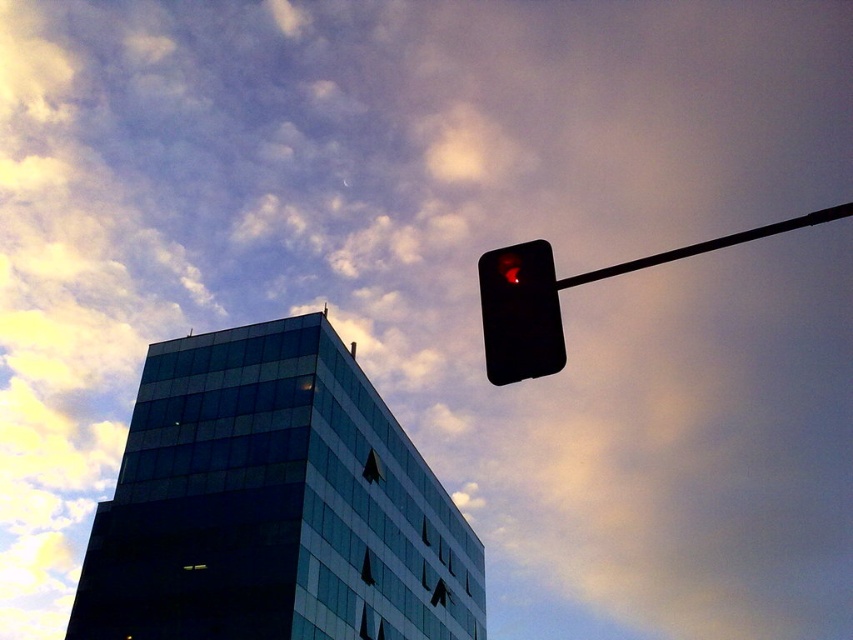
You are a city planner analyzing the traffic light and pole placement. Based on the scene, which object is shorter between the black matte traffic light at upper right and the black plastic pole at upper right?

The black matte traffic light at upper right is shorter than the black plastic pole at upper right.

You are a pedestrian standing at the crosswalk and see the black matte traffic light at upper right and the black plastic pole at upper right. Which object is closer to you?

The black matte traffic light at upper right is closer to you because it is in front of the black plastic pole at upper right.

You are a city planner assessing the placement of the black matte traffic light at upper right and the black plastic pole at upper right. Based on the scene, which object takes up more space in the image?

The black plastic pole at upper right takes up more space in the image than the black matte traffic light at upper right, as the traffic light occupies less space according to the description.